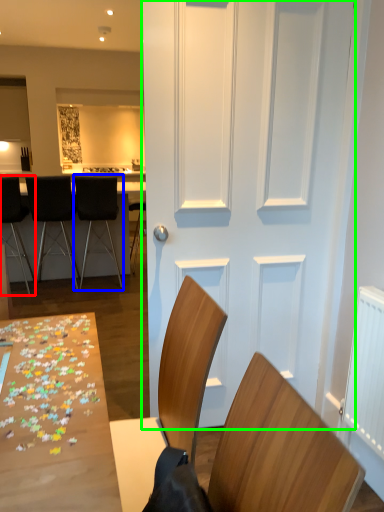
Question: Estimate the real-world distances between objects in this image. Which object is closer to chair (highlighted by a red box), chair (highlighted by a blue box) or door (highlighted by a green box)?

Choices:
 (A) chair
 (B) door

Answer: (A)